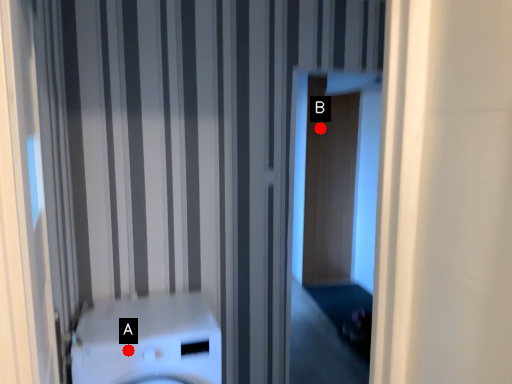
Question: Two points are circled on the image, labeled by A and B beside each circle. Which point appears farthest from the camera in this image?

Choices:
 (A) A is further
 (B) B is further

Answer: (B)